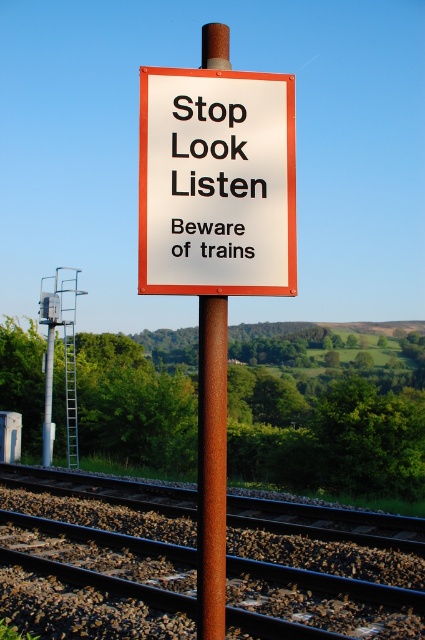
You are standing at point (155, 176) and want to cross the railway tracks. The nearest train is approaching at 30 km per hour. How much time do you have before the train reaches your current position?

The distance between you and the nearest train is 2.90 meters. Since the train is moving at 30 km per hour, converting that speed to meters per second gives approximately 8.33 m per second. Dividing the distance by the speed yields about 0.35 seconds. Therefore, you have approximately 0.35 seconds before the train arrives at your current position.